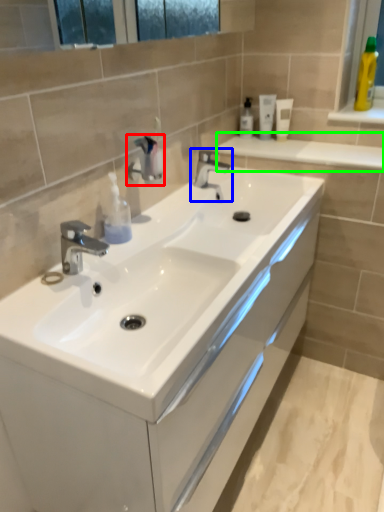
Question: Based on their relative distances, which object is farther from plumbing fixture (highlighted by a red box)? Choose from tap (highlighted by a blue box) and balustrade (highlighted by a green box).

Choices:
 (A) tap
 (B) balustrade

Answer: (B)